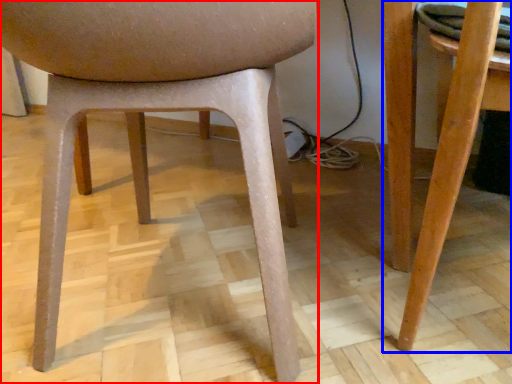
Question: Among these objects, which one is farthest to the camera, chair (highlighted by a red box) or table (highlighted by a blue box)?

Choices:
 (A) chair
 (B) table

Answer: (B)